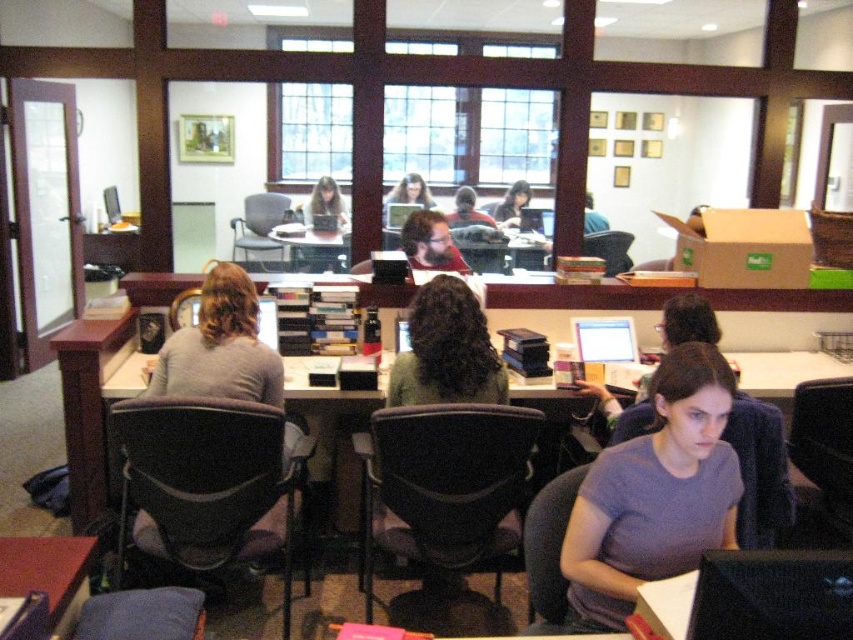
Question: Is matte black monitor at center to the left of matte black hair at center from the viewer's perspective?

Choices:
 (A) yes
 (B) no

Answer: (B)

Question: From the image, what is the correct spatial relationship of gray sweater at left in relation to wooden desk at lower left?

Choices:
 (A) below
 (B) above

Answer: (B)

Question: Which object is closer to the camera taking this photo?

Choices:
 (A) gray sweater at left
 (B) purple matte shirt at center
 (C) wooden desk at lower left
 (D) matte black laptop at center

Answer: (C)

Question: Among these objects, which one is nearest to the camera?

Choices:
 (A) purple matte shirt at center
 (B) wooden desk at lower left
 (C) gray sweater at left

Answer: (B)

Question: Is purple matte shirt at center to the left of gray sweater at left from the viewer's perspective?

Choices:
 (A) no
 (B) yes

Answer: (A)

Question: Which object appears farthest from the camera in this image?

Choices:
 (A) purple matte shirt at center
 (B) matte black laptop at center
 (C) matte black monitor at center

Answer: (B)